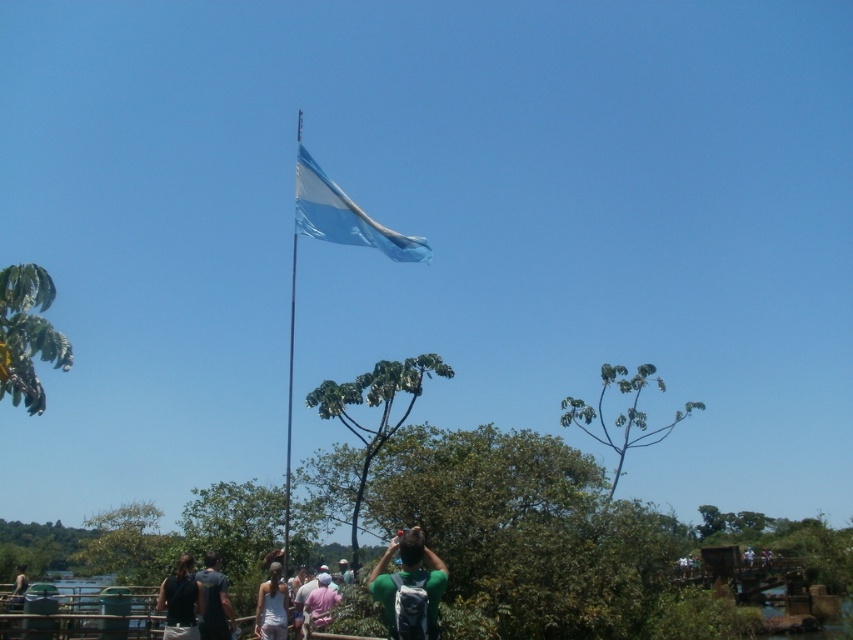
Does blue fabric flag at upper center have a greater width compared to dark brown leather jacket at lower left?

Yes, blue fabric flag at upper center is wider than dark brown leather jacket at lower left.

Between blue fabric flag at upper center and dark brown leather jacket at lower left, which one is positioned higher?

blue fabric flag at upper center is above.

Is point (412, 257) farther from viewer compared to point (178, 572)?

Yes, it is behind point (178, 572).

Find the location of a particular element. blue fabric flag at upper center is located at coordinates (344, 216).

Does white cotton shirt at center appear on the left side of dark blue shirt at center?

No, white cotton shirt at center is not to the left of dark blue shirt at center.

Does white cotton shirt at center have a lesser width compared to dark blue shirt at center?

Incorrect, white cotton shirt at center's width is not less than dark blue shirt at center's.

Is point (281, 605) less distant than point (198, 579)?

No, it is not.

Locate an element on the screen. This screenshot has width=853, height=640. white cotton shirt at center is located at coordinates (273, 600).

Which is behind, point (215, 584) or point (326, 614)?

Point (326, 614)

Between dark blue shirt at center and pink fabric shirt at center, which one has more height?

dark blue shirt at center is taller.

What are the coordinates of `dark blue shirt at center` in the screenshot? It's located at (213, 600).